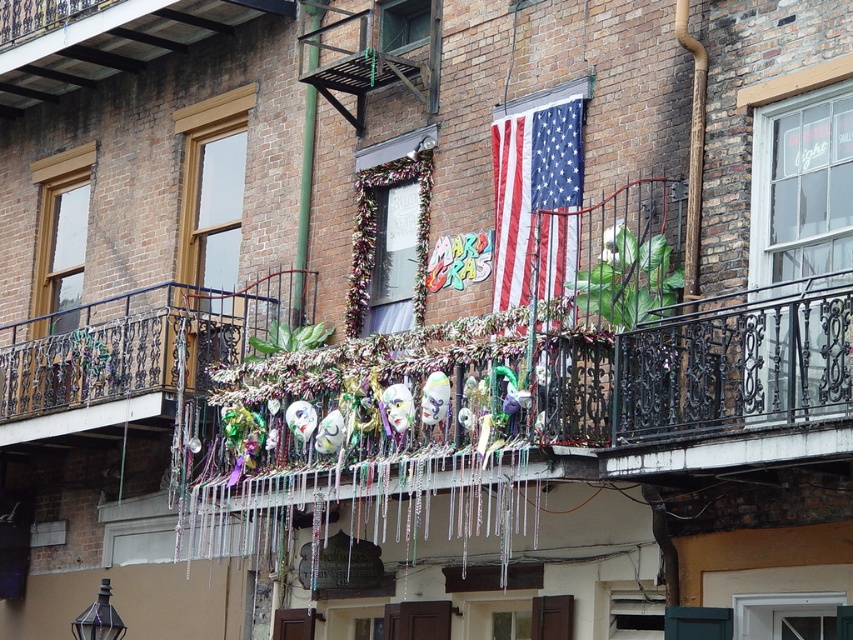
Does point (370, 17) come in front of point (302, 257)?

Yes, it is in front of point (302, 257).

The image size is (853, 640). Identify the location of metallic black balcony at upper center. pyautogui.click(x=374, y=54).

Between american flag at center and metallic black balcony at upper center, which one has less height?

With less height is metallic black balcony at upper center.

Does american flag at center appear on the right side of metallic black balcony at upper center?

Correct, you'll find american flag at center to the right of metallic black balcony at upper center.

Who is more distant from viewer, (502, 145) or (403, 80)?

Point (403, 80)

At what (x,y) coordinates should I click in order to perform the action: click on american flag at center. Please return your answer as a coordinate pair (x, y). Looking at the image, I should click on (537, 200).

Is metallic wrought iron balcony at center below green metal pole at center?

Correct, metallic wrought iron balcony at center is located below green metal pole at center.

Which is in front, point (67, 413) or point (302, 285)?

Point (302, 285) is in front.

At what (x,y) coordinates should I click in order to perform the action: click on metallic wrought iron balcony at center. Please return your answer as a coordinate pair (x, y). This screenshot has width=853, height=640. Looking at the image, I should click on (119, 355).